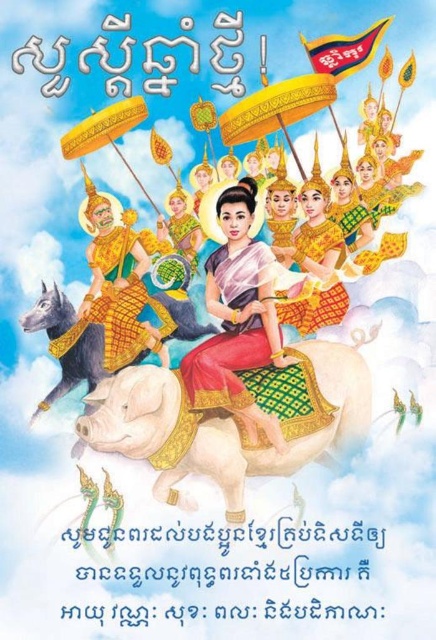
From the picture: Can you confirm if silk fabric woman at center is taller than gold textured armor at center?

Yes, silk fabric woman at center is taller than gold textured armor at center.

Is silk fabric woman at center to the left of gold textured armor at center from the viewer's perspective?

Incorrect, silk fabric woman at center is not on the left side of gold textured armor at center.

Which is in front, point (224, 323) or point (87, 186)?

Point (224, 323)

Where is `silk fabric woman at center`? silk fabric woman at center is located at coordinates (238, 320).

Measure the distance from silk fabric woman at center to dark gray matte horse at center.

silk fabric woman at center and dark gray matte horse at center are 10.80 meters apart.

Based on the photo, does silk fabric woman at center appear on the right side of dark gray matte horse at center?

Correct, you'll find silk fabric woman at center to the right of dark gray matte horse at center.

In order to click on silk fabric woman at center in this screenshot , I will do `click(238, 320)`.

At what (x,y) coordinates should I click in order to perform the action: click on silk fabric woman at center. Please return your answer as a coordinate pair (x, y). The height and width of the screenshot is (640, 436). Looking at the image, I should click on (238, 320).

Is white textured horse at center smaller than silk fabric woman at center?

Incorrect, white textured horse at center is not smaller in size than silk fabric woman at center.

Which is more to the left, white textured horse at center or silk fabric woman at center?

white textured horse at center

Where is `white textured horse at center`? Image resolution: width=436 pixels, height=640 pixels. white textured horse at center is located at coordinates (231, 420).